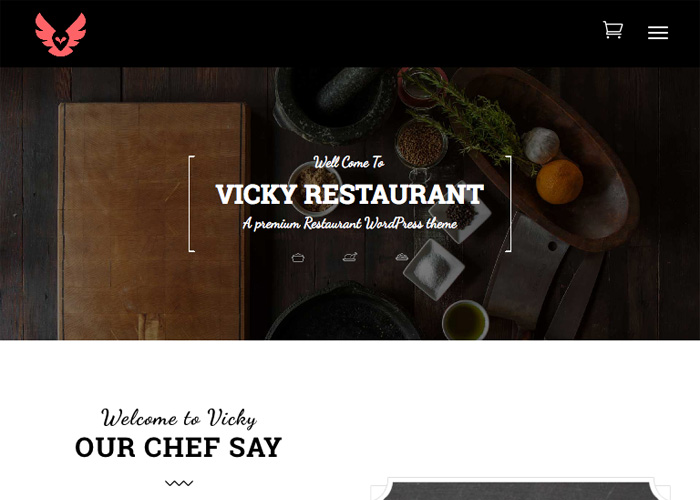
This screenshot has height=500, width=700. I want to click on wooden table top, so click(40, 163).